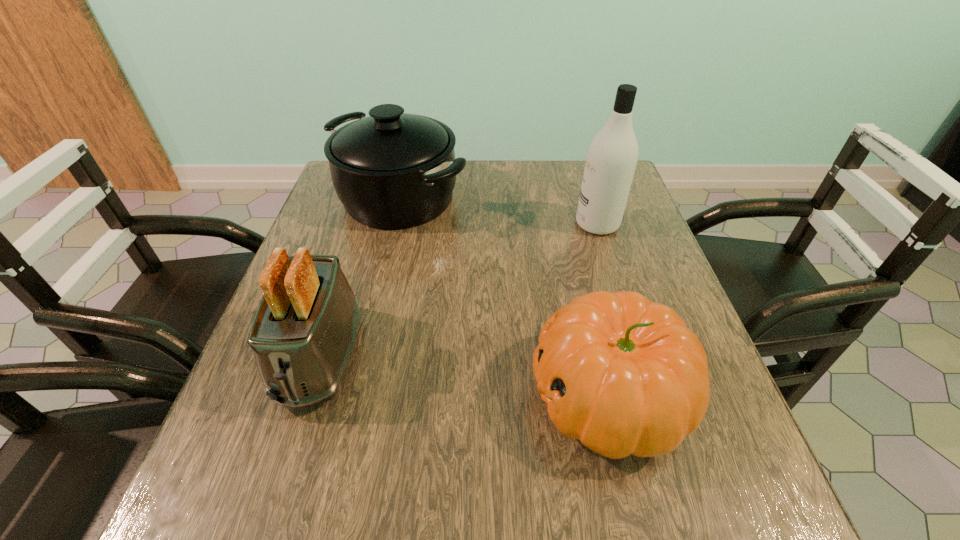
At what (x,y) coordinates should I click in order to perform the action: click on the tallest object. Please return your answer as a coordinate pair (x, y). This screenshot has width=960, height=540. Looking at the image, I should click on (611, 160).

You are a GUI agent. You are given a task and a screenshot of the screen. Output one action in this format:
    pyautogui.click(x=<x>, y=<y>)
    Task: Click on the saucepan
    
    Given the screenshot: What is the action you would take?
    pyautogui.click(x=392, y=170)

The image size is (960, 540). In order to click on toaster in this screenshot , I will do (304, 331).

The width and height of the screenshot is (960, 540). Identify the location of pumpkin. (625, 376).

The height and width of the screenshot is (540, 960). Find the location of `vacant space located on the front-facing side of the shampoo`. vacant space located on the front-facing side of the shampoo is located at coordinates (443, 224).

Identify the location of free space located 0.380m on the front-facing side of the shampoo. This screenshot has height=540, width=960. 426,224.

This screenshot has width=960, height=540. Find the location of `free space located 0.370m on the front-facing side of the shampoo`. free space located 0.370m on the front-facing side of the shampoo is located at coordinates (430, 224).

The image size is (960, 540). I want to click on vacant area situated 0.210m on the front of the saucepan, so click(375, 301).

Where is `free spot located 0.120m on the side of the toaster with the control lever`? This screenshot has width=960, height=540. free spot located 0.120m on the side of the toaster with the control lever is located at coordinates (277, 495).

Where is `vacant region located on the carved face of the pumpkin`? This screenshot has height=540, width=960. vacant region located on the carved face of the pumpkin is located at coordinates (403, 395).